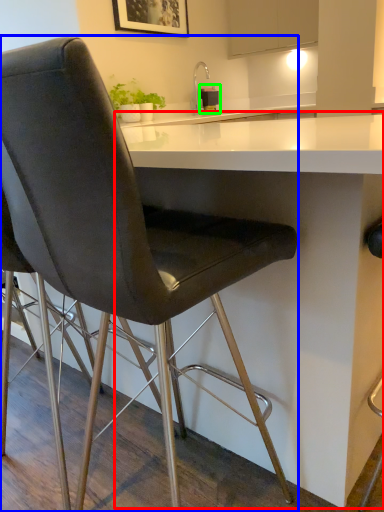
Question: Which is nearer to the table (highlighted by a red box)? chair (highlighted by a blue box) or appliance (highlighted by a green box).

Choices:
 (A) chair
 (B) appliance

Answer: (A)